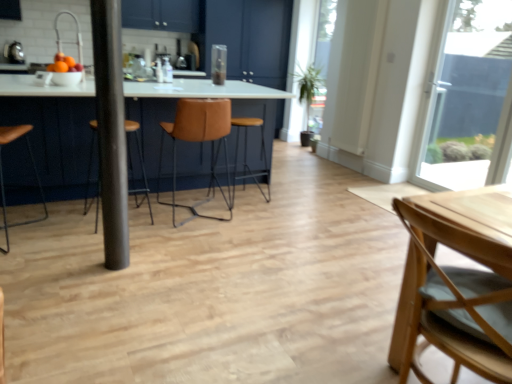
How much space does brown leather stool at center, acting as the 3th chair starting from the right, occupy vertically?

The height of brown leather stool at center, acting as the 3th chair starting from the right, is 77.75 centimeters.

What do you see at coordinates (462, 281) in the screenshot? I see `light wood chair at lower right, arranged as the first chair when viewed from the right` at bounding box center [462, 281].

This screenshot has height=384, width=512. I want to click on leather seat at center, so click(x=246, y=156).

Locate an element on the screen. metallic silver toaster at upper left is located at coordinates (14, 53).

From the image's perspective, is leather seat at center beneath brown leather stool at center, acting as the 3th chair starting from the right?

No, from the image's perspective, leather seat at center is not beneath brown leather stool at center, acting as the 3th chair starting from the right.

Considering the positions of points (261, 142) and (125, 131), is point (261, 142) farther from camera compared to point (125, 131)?

Yes, point (261, 142) is behind point (125, 131).

Considering the positions of objects leather seat at center and brown leather stool at center, acting as the 3th chair starting from the right, in the image provided, who is more to the right, leather seat at center or brown leather stool at center, acting as the 3th chair starting from the right,?

leather seat at center is more to the right.

Which is correct: leather seat at center is inside brown leather stool at center, acting as the 3th chair starting from the right, or outside of it?

leather seat at center is located beyond the bounds of brown leather stool at center, acting as the 3th chair starting from the right.

How distant is shiny orange fruits at left from matte white table at center?

shiny orange fruits at left is 35.47 inches from matte white table at center.

Is shiny orange fruits at left not close to matte white table at center?

shiny orange fruits at left is actually quite close to matte white table at center.

Is shiny orange fruits at left oriented away from matte white table at center?

No, shiny orange fruits at left is not facing away from matte white table at center.

Would you say shiny orange fruits at left is to the left or to the right of matte white table at center in the picture?

shiny orange fruits at left is to the left of matte white table at center.

Is brown leather stool at left, marked as the 1th chair in a left-to-right arrangement, further to the viewer compared to matte white table at center?

No.

Is brown leather stool at left, marked as the 1th chair in a left-to-right arrangement, next to matte white table at center and touching it?

No, brown leather stool at left, marked as the 1th chair in a left-to-right arrangement, is not beside matte white table at center.

From a real-world perspective, relative to matte white table at center, is brown leather stool at left, marked as the 1th chair in a left-to-right arrangement, vertically above or below?

Clearly, from a real-world perspective, brown leather stool at left, marked as the 1th chair in a left-to-right arrangement, is below matte white table at center.

Can you confirm if brown leather stool at left, marked as the 1th chair in a left-to-right arrangement, is shorter than matte white table at center?

No, brown leather stool at left, marked as the 1th chair in a left-to-right arrangement, is not shorter than matte white table at center.

Locate an element on the screen. This screenshot has height=384, width=512. fruit located below the metallic silver toaster at upper left (from the image's perspective) is located at coordinates (64, 64).

Between shiny orange fruits at left and metallic silver toaster at upper left, which one has less height?

shiny orange fruits at left.

Looking at the image, does shiny orange fruits at left seem bigger or smaller compared to metallic silver toaster at upper left?

Considering their sizes, shiny orange fruits at left takes up more space than metallic silver toaster at upper left.

Is shiny orange fruits at left to the left of brown leather stool at left, marked as the 1th chair in a left-to-right arrangement, from the viewer's perspective?

No, shiny orange fruits at left is not to the left of brown leather stool at left, marked as the 1th chair in a left-to-right arrangement.

From the picture: From a real-world perspective, which object stands above the other?

shiny orange fruits at left is physically above.

From the image's perspective, who appears lower, shiny orange fruits at left or brown leather stool at left, marked as the 1th chair in a left-to-right arrangement?

brown leather stool at left, marked as the 1th chair in a left-to-right arrangement, from the image's perspective.

Find the location of a particular element. The height and width of the screenshot is (384, 512). chair to the left of shiny orange fruits at left is located at coordinates (3, 177).

Image resolution: width=512 pixels, height=384 pixels. What are the coordinates of `door located on the right of shiny orange fruits at left` in the screenshot? It's located at (358, 73).

Between white matte door at upper right and shiny orange fruits at left, which one appears on the left side from the viewer's perspective?

Positioned to the left is shiny orange fruits at left.

Is white matte door at upper right positioned with its back to shiny orange fruits at left?

No.

From the picture: Who is bigger, matte dark blue cabinet at center or leather seat at center?

Bigger between the two is matte dark blue cabinet at center.

Is matte dark blue cabinet at center turned away from leather seat at center?

matte dark blue cabinet at center is not turned away from leather seat at center.

Does matte dark blue cabinet at center come in front of leather seat at center?

No, it is behind leather seat at center.

There is a leather seat at center. At what (x,y) coordinates should I click in order to perform the action: click on the 2nd chair above it (from a real-world perspective). Please return your answer as a coordinate pair (x, y). Looking at the image, I should click on (141, 167).

Find the location of `fruit on the left side of matte white table at center`. fruit on the left side of matte white table at center is located at coordinates (64, 64).

Looking at the image, which one is located closer to brown leather stool at left, marked as the 1th chair in a left-to-right arrangement, light wood chair at lower right, arranged as the first chair when viewed from the right, or matte white table at center?

Among the two, matte white table at center is located nearer to brown leather stool at left, marked as the 1th chair in a left-to-right arrangement.

Looking at the image, which one is located further to leather at center, which ranks as the second chair in right-to-left order, brown leather stool at center, the second chair positioned from the left, or metallic pole at center?

metallic pole at center is positioned further to the anchor leather at center, which ranks as the second chair in right-to-left order.

Looking at the image, which one is located further to matte dark blue cabinet at center, shiny orange fruits at left or leather at center, which ranks as the second chair in right-to-left order?

shiny orange fruits at left is further to matte dark blue cabinet at center.

From the image, which object appears to be farther from leather seat at center, metallic silver toaster at upper left or shiny orange fruits at left?

metallic silver toaster at upper left.

Considering their positions, is light wood chair at lower right, arranged as the first chair when viewed from the right, positioned further to leather at center, which ranks as the second chair in right-to-left order, than brown leather stool at left, the 4th chair positioned from the right?

light wood chair at lower right, arranged as the first chair when viewed from the right, lies further to leather at center, which ranks as the second chair in right-to-left order, than the other object.

When comparing their distances from shiny orange fruits at left, does metallic pole at center or brown leather stool at left, marked as the 1th chair in a left-to-right arrangement, seem closer?

Among the two, brown leather stool at left, marked as the 1th chair in a left-to-right arrangement, is located nearer to shiny orange fruits at left.

Which object lies nearer to the anchor point white matte door at upper right, metallic pole at center or brown leather stool at left, the 4th chair positioned from the right?

metallic pole at center is closer to white matte door at upper right.

From the image, which object appears to be nearer to white matte door at upper right, light wood chair at lower right, arranged as the first chair when viewed from the right, or shiny orange fruits at left?

shiny orange fruits at left is closer to white matte door at upper right.

Image resolution: width=512 pixels, height=384 pixels. I want to click on bar stool between metallic pole at center and white matte door at upper right in the front-back direction, so click(x=246, y=156).

Where is `pillar located between metallic silver toaster at upper left and leather seat at center in the left-right direction`? pillar located between metallic silver toaster at upper left and leather seat at center in the left-right direction is located at coordinates (111, 130).

You are a GUI agent. You are given a task and a screenshot of the screen. Output one action in this format:
    pyautogui.click(x=<x>, y=<y>)
    Task: Click on the fruit located between matte white table at center and matte dark blue cabinet at center in the depth direction
    This screenshot has width=512, height=384.
    Given the screenshot: What is the action you would take?
    pyautogui.click(x=64, y=64)

The height and width of the screenshot is (384, 512). In order to click on pillar located between matte white table at center and transparent glass window at upper right in the left-right direction in this screenshot , I will do `click(111, 130)`.